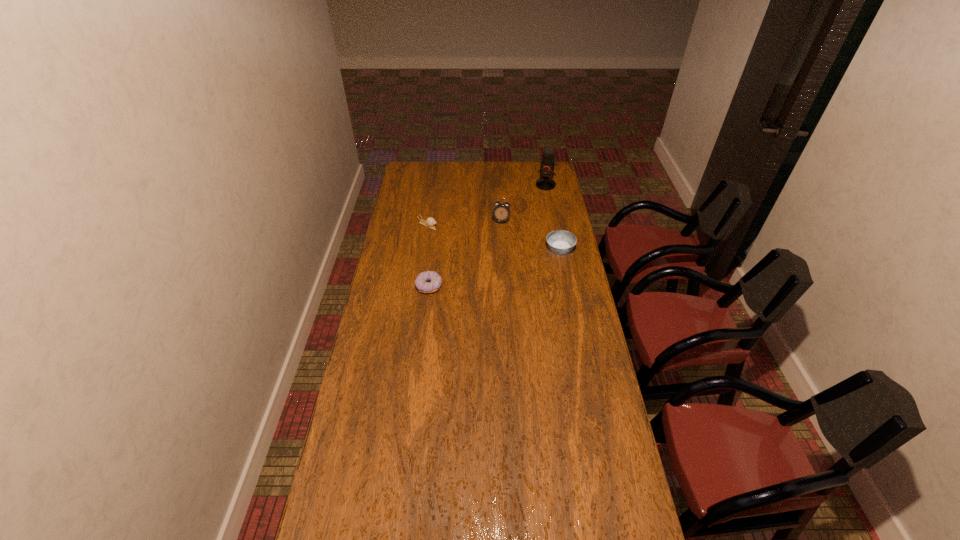
Where is `free spot on the desktop that is between the nearest object and the third shortest object and is positioned on the side of the microphone with the red ring`? free spot on the desktop that is between the nearest object and the third shortest object and is positioned on the side of the microphone with the red ring is located at coordinates (509, 264).

This screenshot has height=540, width=960. I want to click on vacant spot on the desktop that is between the doughnut and the ashtray and is positioned on the shell of the escargot, so click(514, 262).

This screenshot has width=960, height=540. Identify the location of free space on the desktop that is between the nearest object and the third shortest object and is positioned on the face of the third object from left to right. (493, 268).